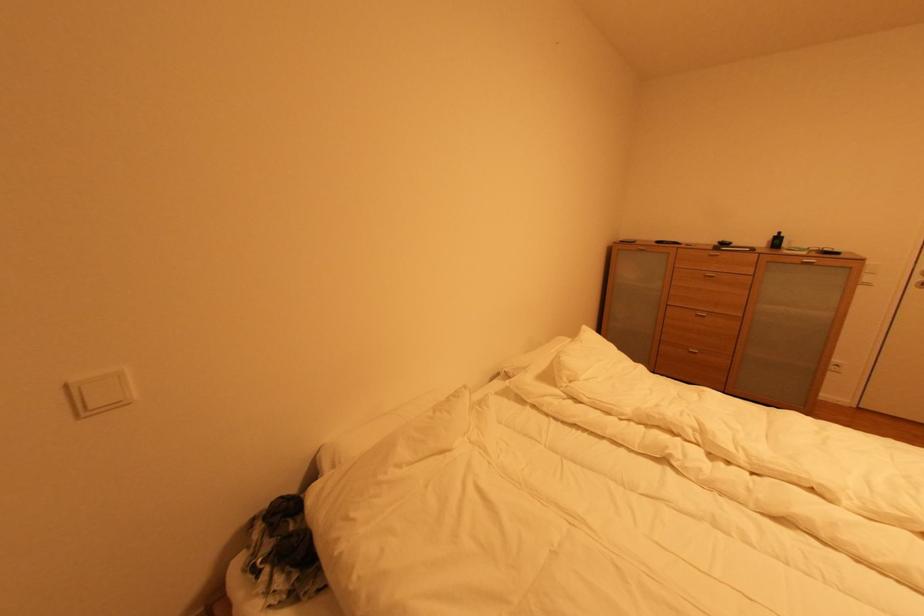
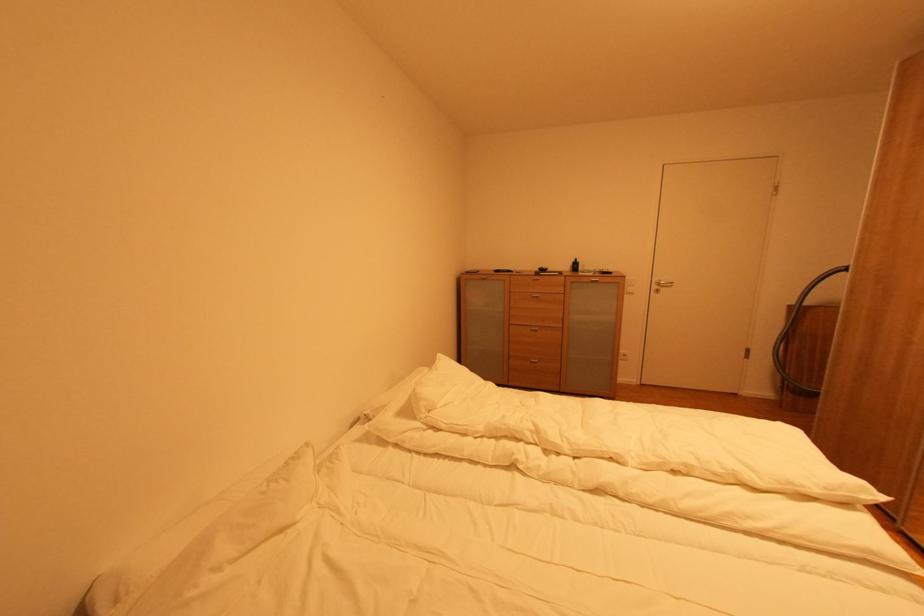
Find the pixel in the second image that matches (718,278) in the first image.

(542, 298)